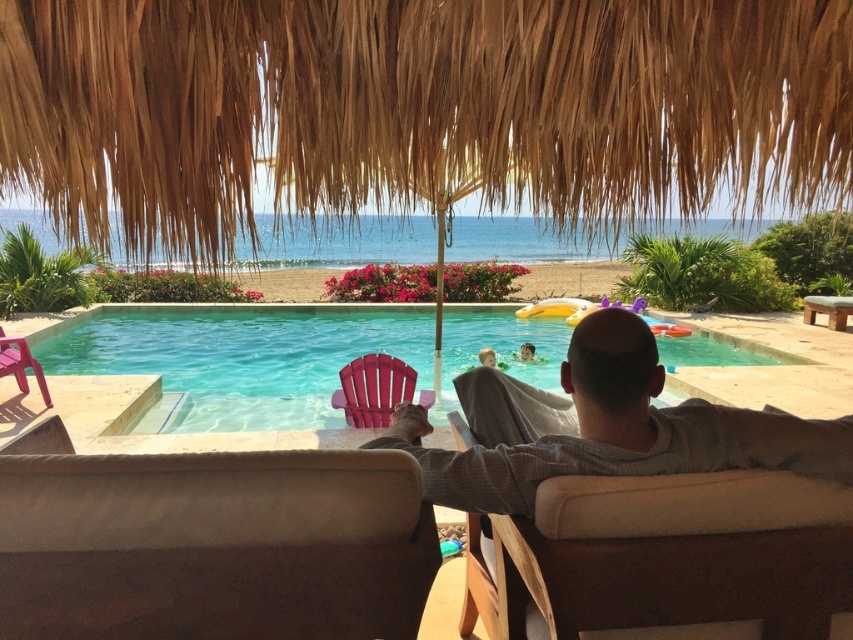
Who is positioned more to the left, clear blue water at center or plastic beach chair at lower left?

plastic beach chair at lower left is more to the left.

Between clear blue water at center and plastic beach chair at lower left, which one is positioned higher?

clear blue water at center is higher up.

The width and height of the screenshot is (853, 640). Describe the element at coordinates (234, 356) in the screenshot. I see `clear blue water at center` at that location.

This screenshot has height=640, width=853. What are the coordinates of `clear blue water at center` in the screenshot? It's located at (234, 356).

Which is more to the right, beige fabric beach chair at center or gray cotton shirt at center?

Positioned to the right is gray cotton shirt at center.

How distant is beige fabric beach chair at center from gray cotton shirt at center?

The distance of beige fabric beach chair at center from gray cotton shirt at center is 6.82 inches.

Does point (630, 586) come closer to viewer compared to point (608, 392)?

That is True.

Locate an element on the screen. beige fabric beach chair at center is located at coordinates (666, 554).

In the scene shown: Between clear blue water at center and gray cotton shirt at center, which one has less height?

With less height is gray cotton shirt at center.

Find the location of a particular element. This screenshot has width=853, height=640. clear blue water at center is located at coordinates (234, 356).

I want to click on clear blue water at center, so click(234, 356).